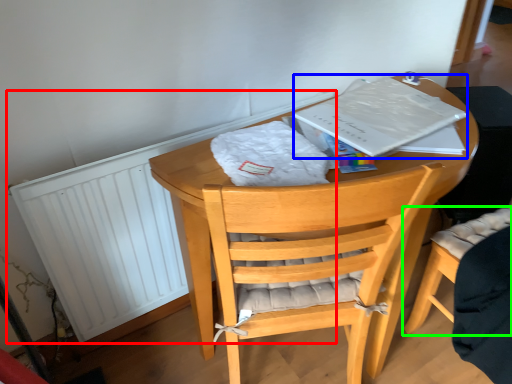
Question: Which object is the closest to the radiator (highlighted by a red box)? Choose among these: paperback book (highlighted by a blue box) or chair (highlighted by a green box).

Choices:
 (A) paperback book
 (B) chair

Answer: (A)